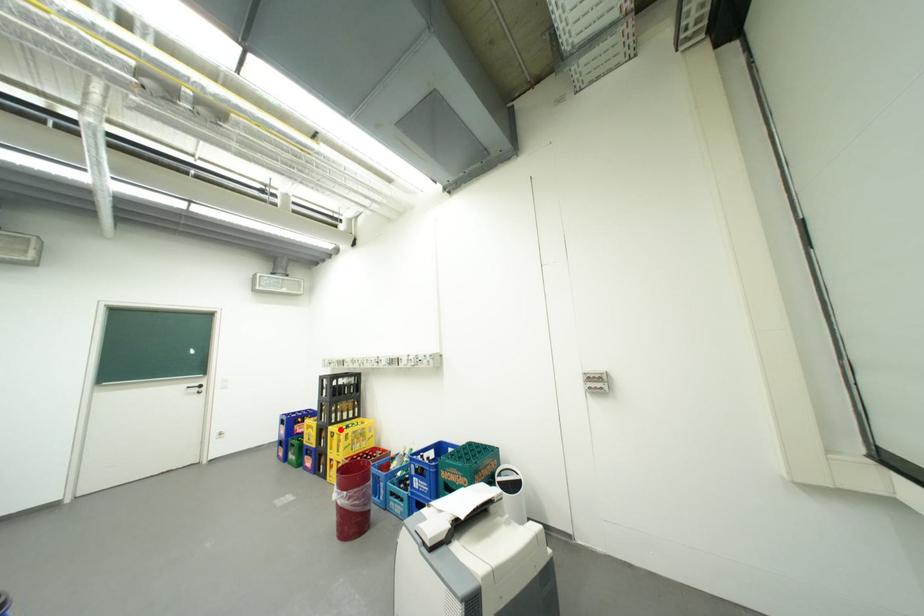
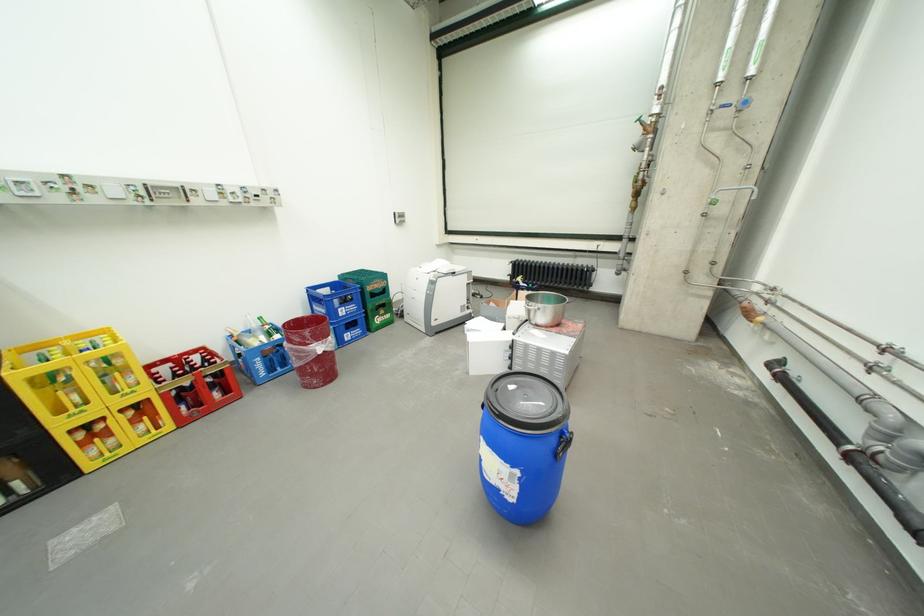
Question: I am providing you with two images of the same scene from different viewpoints. A red point is marked on the first image. Can you still see the location of the red point in image 2?

Choices:
 (A) Yes
 (B) No

Answer: (A)